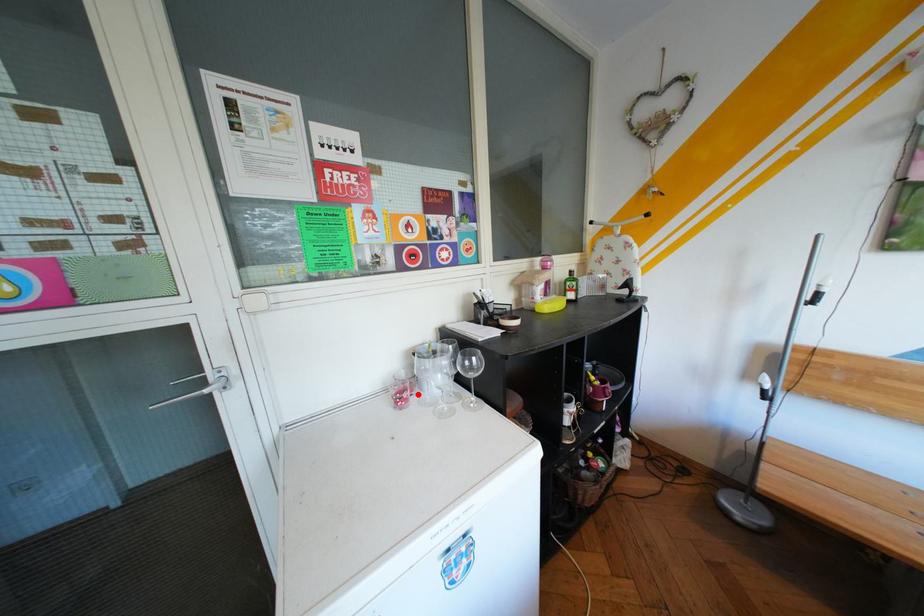
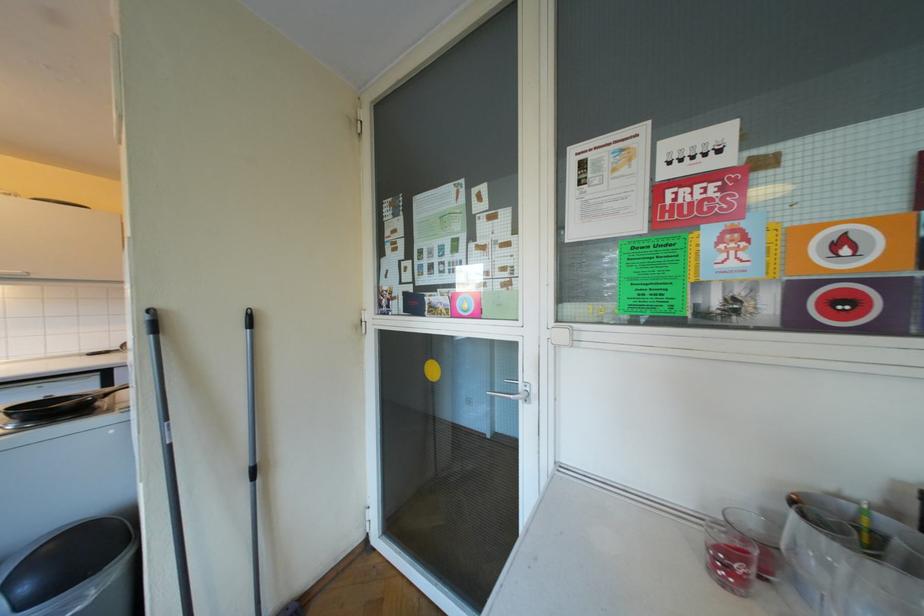
Question: I am providing you with two images of the same scene from different viewpoints. In image1, a red point is highlighted. Considering the same 3D point in image2, which of the following is correct?

Choices:
 (A) It is closer
 (B) It is farther

Answer: (A)